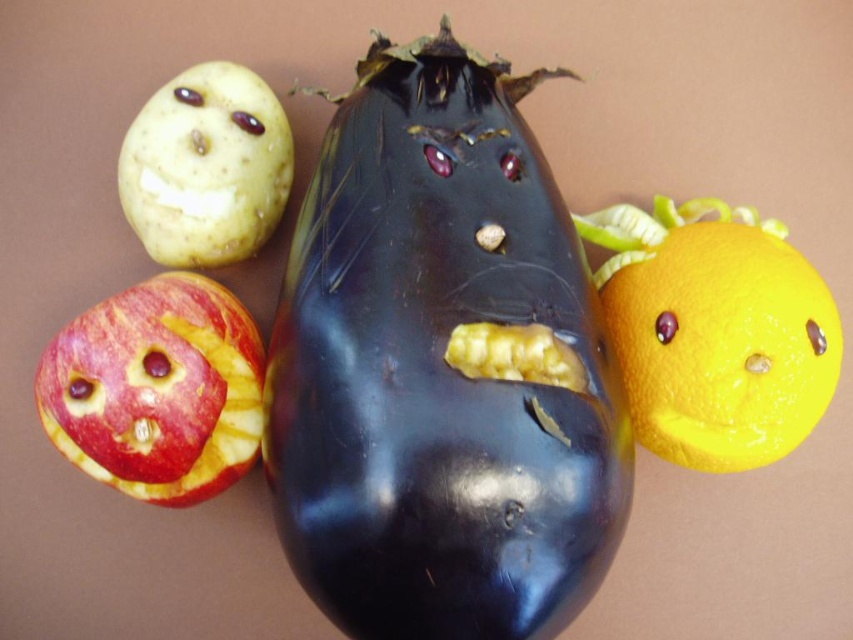
You are an artist arranging fruits and vegetables for a display. You have a smooth red apple at lower left and a yellow matte potato at upper left. Which object should you place higher to make them the same height?

The smooth red apple at lower left is taller than the yellow matte potato at upper left. To make them the same height, you should place the yellow matte potato at upper left higher than the smooth red apple at lower left.

You are an artist arranging fruits and vegetables for a display. You have a smooth red apple at lower left and a yellow matte potato at upper left. Which object has a greater width?

The smooth red apple at lower left has a greater width than the yellow matte potato at upper left.